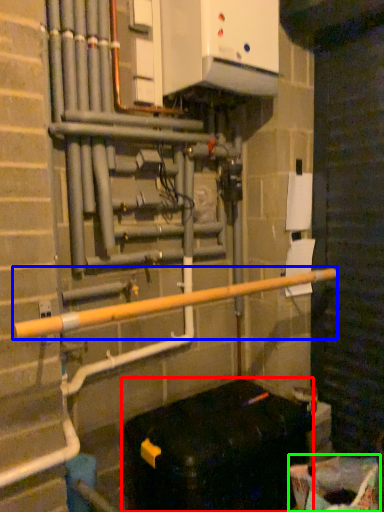
Question: Estimate the real-world distances between objects in this image. Which object is farther from furniture (highlighted by a red box), rail (highlighted by a blue box) or recycling bin (highlighted by a green box)?

Choices:
 (A) rail
 (B) recycling bin

Answer: (A)